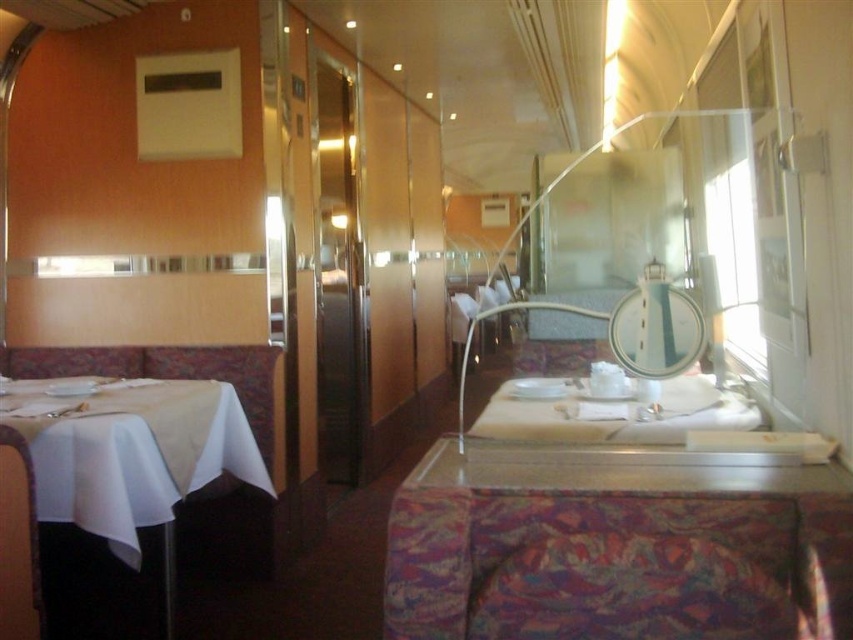
Consider the image. You are a passenger sitting in the train dining car and want to place your phone on the table. Can you put it on the patterned fabric table at center without it falling off onto the white glossy plate at center?

The patterned fabric table at center is below the white glossy plate at center, so placing your phone on the table would risk it falling onto the plate below.

You are a server in the train dining car. You need to place a 1.2 meter long tray from the white cloth table at left to the white glossy plate at center. Can you do it without the tray touching the floor?

The distance between the white cloth table at left and the white glossy plate at center is 1.28 meters. Since the tray is 1.2 meters long, it can be placed horizontally between them without touching the floor.

You are a passenger on the train and want to place your luggage on the table closest to the aisle. Which table should you choose between the patterned fabric table at center and the white cloth table at left?

The white cloth table at left is closer to the aisle. Since the patterned fabric table at center is above the white cloth table at left, the white cloth table at left is positioned lower and likely closer to the aisle.